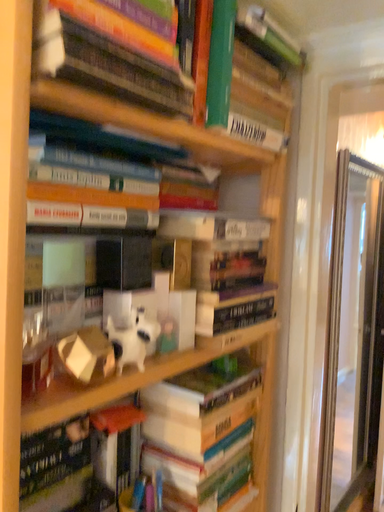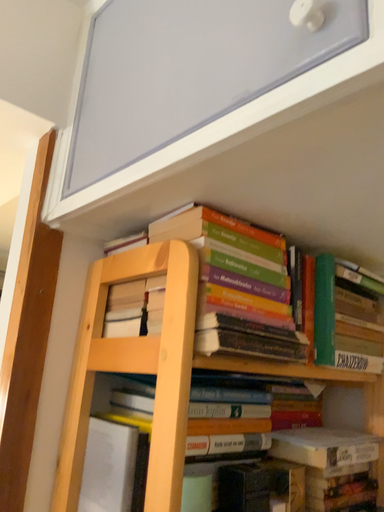
Question: Which way did the camera rotate in the video?

Choices:
 (A) rotated right
 (B) rotated left

Answer: (B)